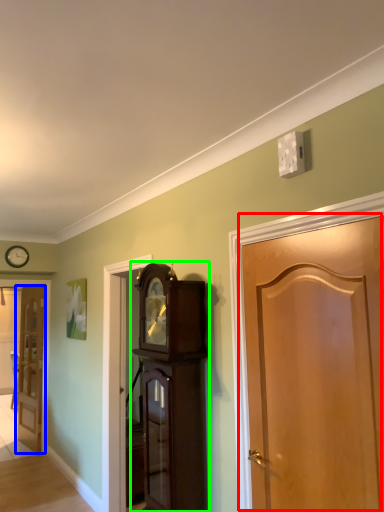
Question: Based on their relative distances, which object is farther from door (highlighted by a red box)? Choose from door (highlighted by a blue box) and cabinetry (highlighted by a green box).

Choices:
 (A) door
 (B) cabinetry

Answer: (A)